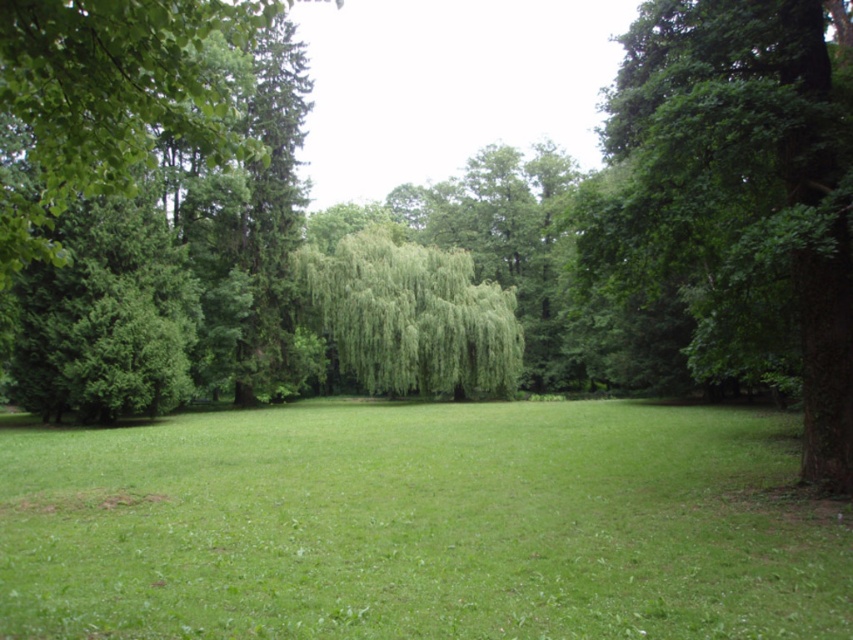
Question: From the image, what is the correct spatial relationship of green leafy tree at right in relation to green leafy willow at center?

Choices:
 (A) above
 (B) below

Answer: (A)

Question: Which is farther from the green grass at center?

Choices:
 (A) green leafy tree at right
 (B) green leafy willow at center

Answer: (B)

Question: Which of these objects is positioned closest to the green leafy willow at center?

Choices:
 (A) green leafy tree at right
 (B) green grass at center

Answer: (A)

Question: Is green leafy tree at right thinner than green leafy willow at center?

Choices:
 (A) yes
 (B) no

Answer: (A)

Question: Which object appears closest to the camera in this image?

Choices:
 (A) green grass at center
 (B) green leafy tree at right

Answer: (A)

Question: Is green grass at center closer to camera compared to green leafy tree at right?

Choices:
 (A) no
 (B) yes

Answer: (B)